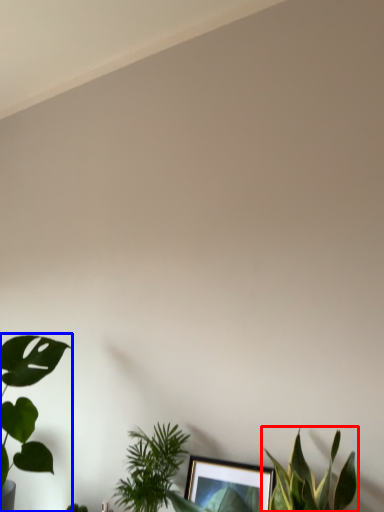
Question: Which object is further to the camera taking this photo, houseplant (highlighted by a red box) or houseplant (highlighted by a blue box)?

Choices:
 (A) houseplant
 (B) houseplant

Answer: (B)